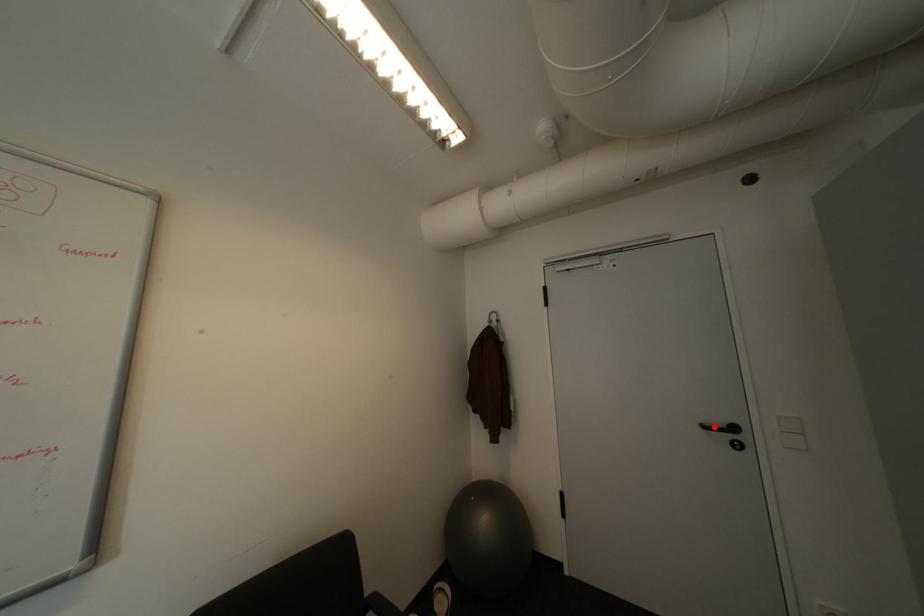
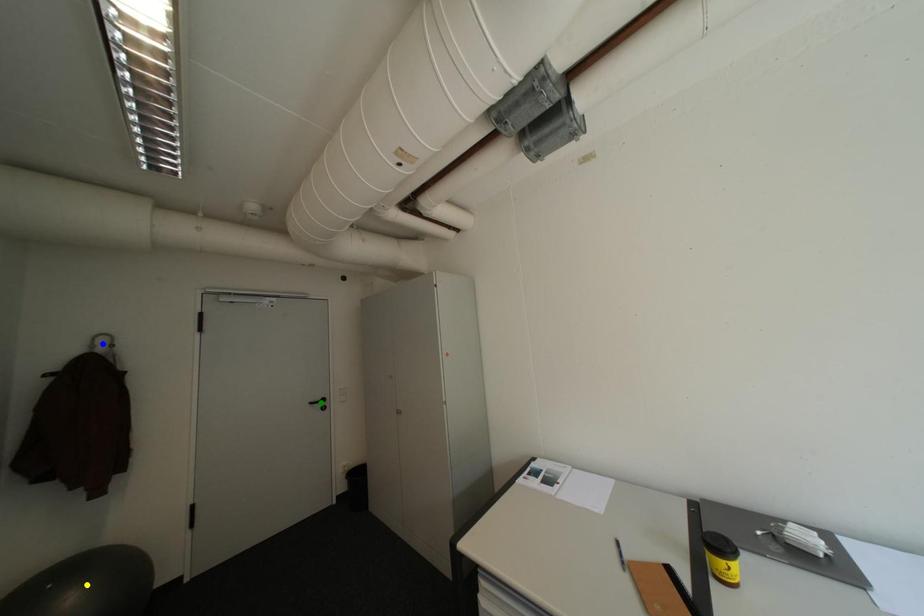
Question: I am providing you with two images of the same scene from different viewpoints. A red point is marked on the first image. You are given multiple points on the second image. Which spot in image 2 lines up with the point in image 1?

Choices:
 (A) blue point
 (B) yellow point
 (C) green point

Answer: (C)